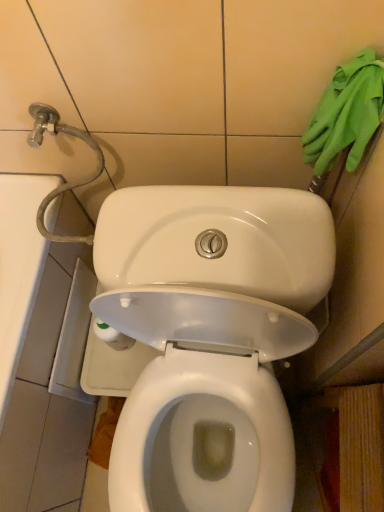
Describe the element at coordinates (346, 113) in the screenshot. I see `green rubber gloves at upper right` at that location.

What is the approximate height of green rubber gloves at upper right?

green rubber gloves at upper right is 9.16 inches in height.

Find the location of a particular element. green rubber gloves at upper right is located at coordinates (346, 113).

What do you see at coordinates (208, 338) in the screenshot? I see `white glossy toilet at center` at bounding box center [208, 338].

This screenshot has height=512, width=384. In order to click on white glossy toilet at center in this screenshot , I will do `click(208, 338)`.

Identify the location of green rubber gloves at upper right. The width and height of the screenshot is (384, 512). (346, 113).

Which object is positioned more to the left, white glossy toilet at center or green rubber gloves at upper right?

Positioned to the left is white glossy toilet at center.

Considering the relative positions of white glossy toilet at center and green rubber gloves at upper right in the image provided, is white glossy toilet at center in front of green rubber gloves at upper right?

Yes, white glossy toilet at center is closer to the camera.

Does point (230, 328) appear closer or farther from the camera than point (366, 115)?

Point (230, 328) appears to be farther away from the viewer than point (366, 115).

From the image's perspective, is white glossy toilet at center located beneath green rubber gloves at upper right?

Correct, white glossy toilet at center appears lower than green rubber gloves at upper right in the image.

From a real-world perspective, which object rests below the other?

From a 3D spatial view, white glossy toilet at center is below.

Is white glossy toilet at center thinner than green rubber gloves at upper right?

Incorrect, the width of white glossy toilet at center is not less than that of green rubber gloves at upper right.

Considering the relative sizes of white glossy toilet at center and green rubber gloves at upper right in the image provided, is white glossy toilet at center shorter than green rubber gloves at upper right?

In fact, white glossy toilet at center may be taller than green rubber gloves at upper right.

Is white glossy toilet at center bigger or smaller than green rubber gloves at upper right?

white glossy toilet at center is bigger than green rubber gloves at upper right.

Is white glossy toilet at center not inside green rubber gloves at upper right?

Absolutely, white glossy toilet at center is external to green rubber gloves at upper right.

Is white glossy toilet at center positioned far away from green rubber gloves at upper right?

That's not correct — white glossy toilet at center is a little close to green rubber gloves at upper right.

Does white glossy toilet at center turn towards green rubber gloves at upper right?

No, white glossy toilet at center does not turn towards green rubber gloves at upper right.

Can you tell me how much white glossy toilet at center and green rubber gloves at upper right differ in facing direction?

0.00254 degrees.

Measure the distance from white glossy toilet at center to green rubber gloves at upper right.

white glossy toilet at center is 16.02 inches away from green rubber gloves at upper right.

What are the coordinates of `material that appears above the white glossy toilet at center (from the image's perspective)` in the screenshot? It's located at (346, 113).

Is green rubber gloves at upper right at the left side of white glossy toilet at center?

No, green rubber gloves at upper right is not to the left of white glossy toilet at center.

Is green rubber gloves at upper right positioned before white glossy toilet at center?

No, green rubber gloves at upper right is behind white glossy toilet at center.

Is point (357, 65) closer to viewer compared to point (229, 474)?

Yes.

From the image's perspective, does green rubber gloves at upper right appear higher than white glossy toilet at center?

Yes, from the image's perspective, green rubber gloves at upper right is above white glossy toilet at center.

From a real-world perspective, is green rubber gloves at upper right physically located above or below white glossy toilet at center?

In terms of real-world spatial position, green rubber gloves at upper right is above white glossy toilet at center.

Looking at their sizes, would you say green rubber gloves at upper right is wider or thinner than white glossy toilet at center?

green rubber gloves at upper right is thinner than white glossy toilet at center.

Is green rubber gloves at upper right taller or shorter than white glossy toilet at center?

green rubber gloves at upper right is shorter than white glossy toilet at center.

Does green rubber gloves at upper right have a smaller size compared to white glossy toilet at center?

Indeed, green rubber gloves at upper right has a smaller size compared to white glossy toilet at center.

Is green rubber gloves at upper right spatially inside white glossy toilet at center, or outside of it?

The correct answer is: outside.

Is there a large distance between green rubber gloves at upper right and white glossy toilet at center?

No, green rubber gloves at upper right is not far away from white glossy toilet at center.

Is white glossy toilet at center at the back of green rubber gloves at upper right?

That's not correct — green rubber gloves at upper right is not looking away from white glossy toilet at center.

Can you tell me how much green rubber gloves at upper right and white glossy toilet at center differ in facing direction?

green rubber gloves at upper right and white glossy toilet at center are facing 0.00254 degrees away from each other.

Measure the distance between green rubber gloves at upper right and white glossy toilet at center.

16.02 inches.

The width and height of the screenshot is (384, 512). Identify the location of toilet below the green rubber gloves at upper right (from a real-world perspective). (208, 338).

You are a GUI agent. You are given a task and a screenshot of the screen. Output one action in this format:
    pyautogui.click(x=<x>, y=<y>)
    Task: Click on the toilet that is in front of the green rubber gloves at upper right
    
    Given the screenshot: What is the action you would take?
    pyautogui.click(x=208, y=338)

At what (x,y) coordinates should I click in order to perform the action: click on material behind the white glossy toilet at center. Please return your answer as a coordinate pair (x, y). The image size is (384, 512). Looking at the image, I should click on (346, 113).